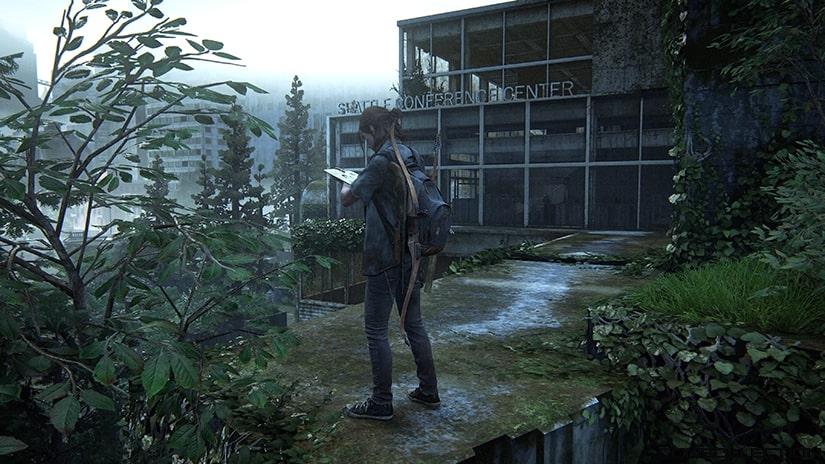
Locate an element on the screen. windows is located at coordinates (649, 193), (625, 194), (558, 133), (455, 134), (484, 45).